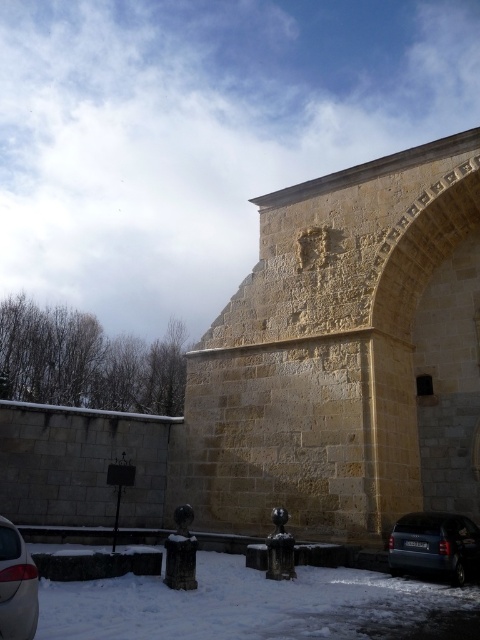
Question: Does yellow stone church at center have a larger size compared to matte black car at lower left?

Choices:
 (A) yes
 (B) no

Answer: (A)

Question: Does yellow stone church at center have a larger size compared to dark blue metallic car at lower right?

Choices:
 (A) yes
 (B) no

Answer: (A)

Question: Which point is closer to the camera taking this photo?

Choices:
 (A) (339, 324)
 (B) (395, 624)
 (C) (435, 573)
 (D) (0, 600)

Answer: (D)

Question: Which object appears closest to the camera in this image?

Choices:
 (A) white powdery snow at lower left
 (B) matte black car at lower left

Answer: (B)

Question: Is white powdery snow at lower left above dark blue metallic car at lower right?

Choices:
 (A) yes
 (B) no

Answer: (A)

Question: Among these points, which one is nearest to the camera?

Choices:
 (A) (451, 508)
 (B) (476, 573)
 (C) (7, 525)
 (D) (269, 612)

Answer: (C)